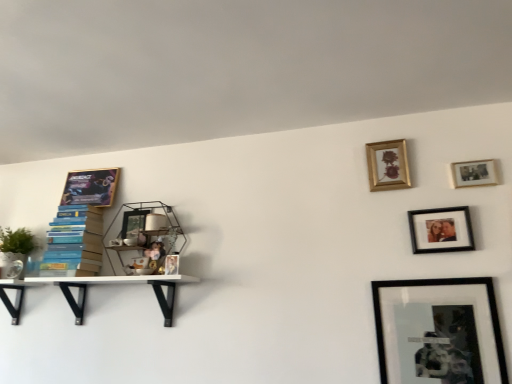
Question: Is wooden photo frame at upper right, the 3th picture frame in the front-to-back sequence, closer to the viewer compared to metallic glass picture frame at left, marked as the second picture frame in a left-to-right arrangement?

Choices:
 (A) no
 (B) yes

Answer: (B)

Question: Is wooden photo frame at upper right, acting as the 6th picture frame starting from the left, shorter than metallic glass picture frame at left, which ranks as the fifth picture frame in right-to-left order?

Choices:
 (A) no
 (B) yes

Answer: (B)

Question: Does wooden photo frame at upper right, which appears as the 4th picture frame when viewed from the back, lie behind metallic glass picture frame at left, which ranks as the fifth picture frame in right-to-left order?

Choices:
 (A) no
 (B) yes

Answer: (A)

Question: Can you confirm if wooden photo frame at upper right, the first picture frame when ordered from right to left, is taller than metallic glass picture frame at left, marked as the 5th picture frame in a front-to-back arrangement?

Choices:
 (A) no
 (B) yes

Answer: (A)

Question: From the image's perspective, is wooden photo frame at upper right, acting as the 6th picture frame starting from the left, below metallic glass picture frame at left, marked as the 5th picture frame in a front-to-back arrangement?

Choices:
 (A) no
 (B) yes

Answer: (A)

Question: From the image's perspective, is wooden photo frame at upper right, the first picture frame when ordered from right to left, on top of metallic glass picture frame at left, which ranks as the fifth picture frame in right-to-left order?

Choices:
 (A) no
 (B) yes

Answer: (B)

Question: From a real-world perspective, is matte black picture frame at upper right, positioned as the 5th picture frame in back-to-front order, located beneath black matte picture frame at lower right, positioned as the 3th picture frame in right-to-left order?

Choices:
 (A) no
 (B) yes

Answer: (A)

Question: From the image's perspective, is matte black picture frame at upper right, positioned as the fifth picture frame in left-to-right order, above black matte picture frame at lower right, which ranks as the fourth picture frame in left-to-right order?

Choices:
 (A) no
 (B) yes

Answer: (B)

Question: Is matte black picture frame at upper right, which is the 2th picture frame from right to left, further to the viewer compared to black matte picture frame at lower right, which ranks as the 6th picture frame in back-to-front order?

Choices:
 (A) no
 (B) yes

Answer: (B)

Question: From a real-world perspective, is matte black picture frame at upper right, positioned as the 5th picture frame in back-to-front order, physically above black matte picture frame at lower right, positioned as the 3th picture frame in right-to-left order?

Choices:
 (A) yes
 (B) no

Answer: (A)

Question: Does matte black picture frame at upper right, which is counted as the 2th picture frame, starting from the front, have a lesser width compared to black matte picture frame at lower right, the 1th picture frame positioned from the front?

Choices:
 (A) no
 (B) yes

Answer: (B)

Question: Does matte black picture frame at upper right, which is counted as the 2th picture frame, starting from the front, have a greater width compared to black matte picture frame at lower right, the 1th picture frame positioned from the front?

Choices:
 (A) no
 (B) yes

Answer: (A)

Question: Is matte black picture frame at upper right, which is the 2th picture frame from right to left, oriented towards metallic wire shelf at upper center, which is the first shelf from right to left?

Choices:
 (A) no
 (B) yes

Answer: (A)